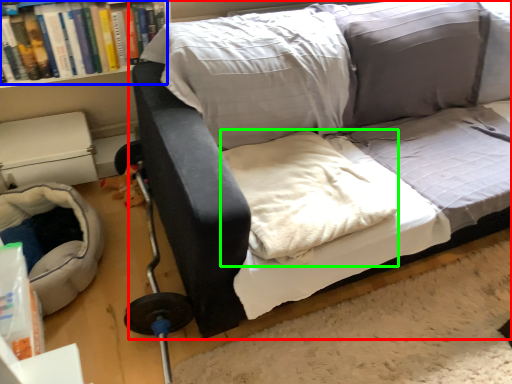
Question: Which is farther away from studio couch (highlighted by a red box)? book (highlighted by a blue box) or linen (highlighted by a green box)?

Choices:
 (A) book
 (B) linen

Answer: (A)